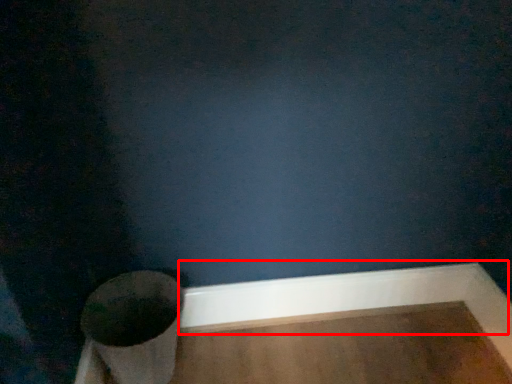
Question: Considering the relative positions of molding (annotated by the red box) and toilet in the image provided, where is molding (annotated by the red box) located with respect to the staircase?

Choices:
 (A) left
 (B) right

Answer: (B)